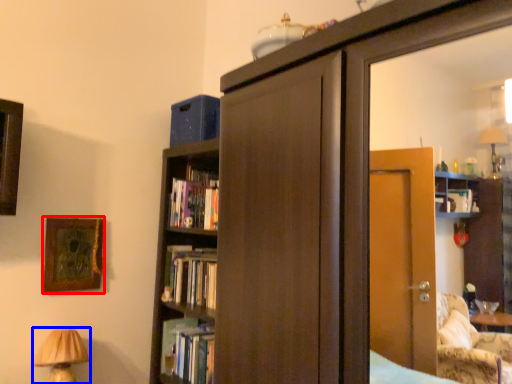
Question: Which of the following is the closest to the observer, picture frame (highlighted by a red box) or table lamp (highlighted by a blue box)?

Choices:
 (A) picture frame
 (B) table lamp

Answer: (B)